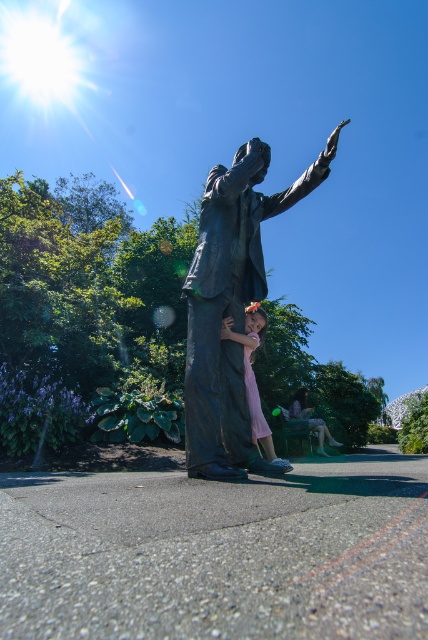
Question: Is bronze statue at center positioned at the back of matte green dress at lower right?

Choices:
 (A) yes
 (B) no

Answer: (B)

Question: Which object is the closest to the bronze statue at center?

Choices:
 (A) matte green dress at lower right
 (B) pink fabric dress at center

Answer: (B)

Question: Does pink fabric dress at center appear under matte green dress at lower right?

Choices:
 (A) no
 (B) yes

Answer: (A)

Question: Which point is closer to the camera taking this photo?

Choices:
 (A) (241, 221)
 (B) (255, 324)
 (C) (327, 429)

Answer: (A)

Question: Does pink fabric dress at center appear on the right side of matte green dress at lower right?

Choices:
 (A) yes
 (B) no

Answer: (B)

Question: Based on their relative distances, which object is nearer to the pink fabric dress at center?

Choices:
 (A) bronze statue at center
 (B) matte green dress at lower right

Answer: (A)